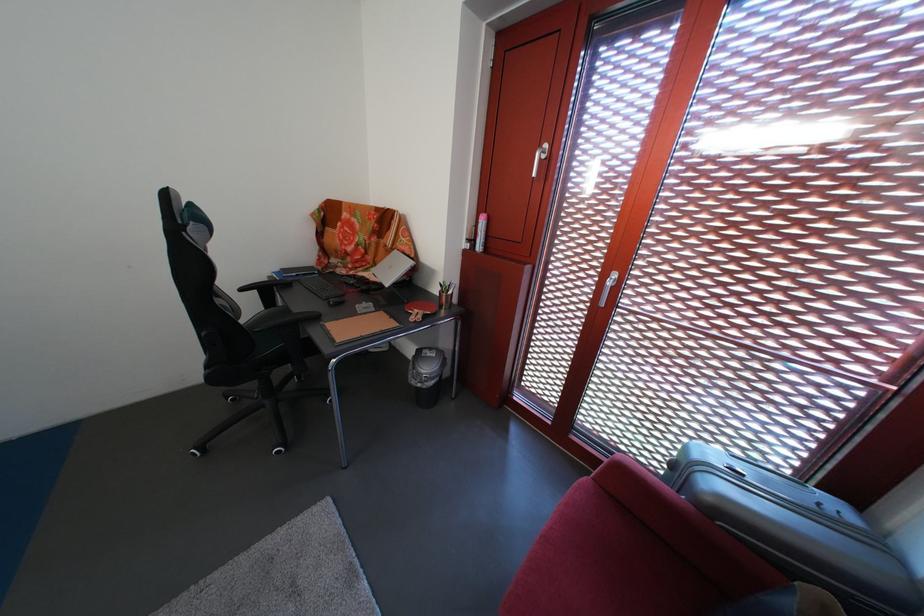
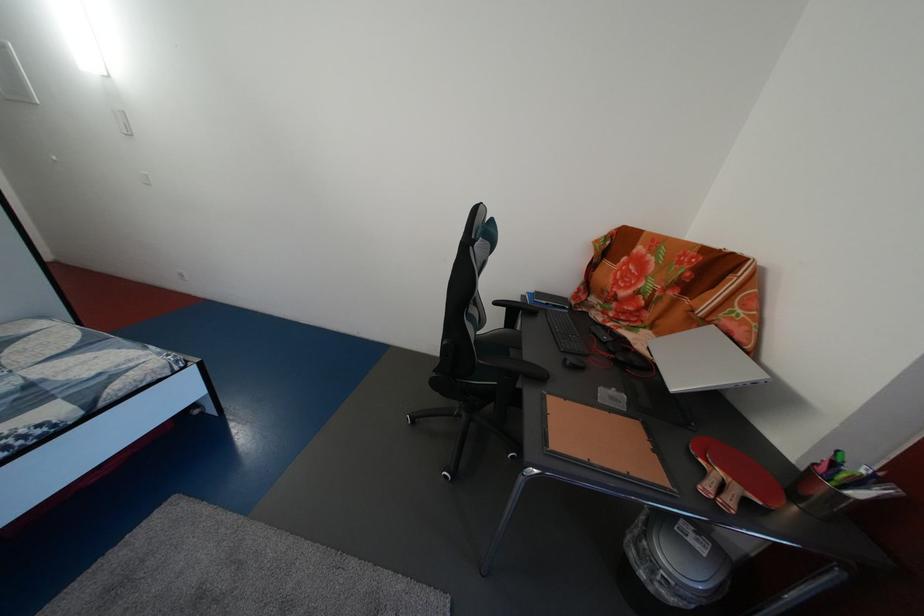
In the second image, find the point that corresponds to [452,292] in the first image.

(845, 471)